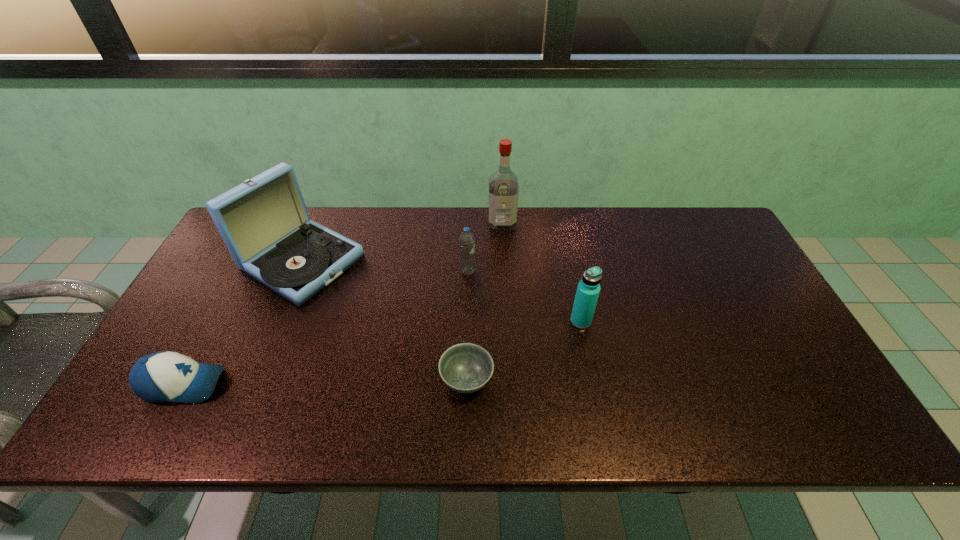
Image resolution: width=960 pixels, height=540 pixels. In order to click on vacant area that lies between the fifth tallest object and the liquor in this screenshot , I will do [343, 304].

Locate an element on the screen. The width and height of the screenshot is (960, 540). vacant point located between the phonograph record and the shortest object is located at coordinates (385, 321).

Locate an element on the screen. This screenshot has height=540, width=960. blank region between the baseball cap and the right water bottle is located at coordinates (382, 353).

Locate an element on the screen. This screenshot has height=540, width=960. unoccupied area between the phonograph record and the tallest object is located at coordinates (402, 243).

The width and height of the screenshot is (960, 540). Find the location of `free space between the shorter water bottle and the bowl`. free space between the shorter water bottle and the bowl is located at coordinates (468, 326).

This screenshot has width=960, height=540. Identify the location of vacant point located between the shortest object and the fifth shortest object. (385, 321).

Image resolution: width=960 pixels, height=540 pixels. What are the coordinates of `vacant space that is in between the shortest object and the liquor` in the screenshot? It's located at (485, 302).

Where is `vacant space in between the bowl and the second shortest object`? The image size is (960, 540). vacant space in between the bowl and the second shortest object is located at coordinates (325, 382).

Locate an element on the screen. The height and width of the screenshot is (540, 960). object that is the third closest one to the tallest object is located at coordinates (264, 222).

Find the location of `object that can be found as the fifth closest to the phonograph record`. object that can be found as the fifth closest to the phonograph record is located at coordinates (588, 289).